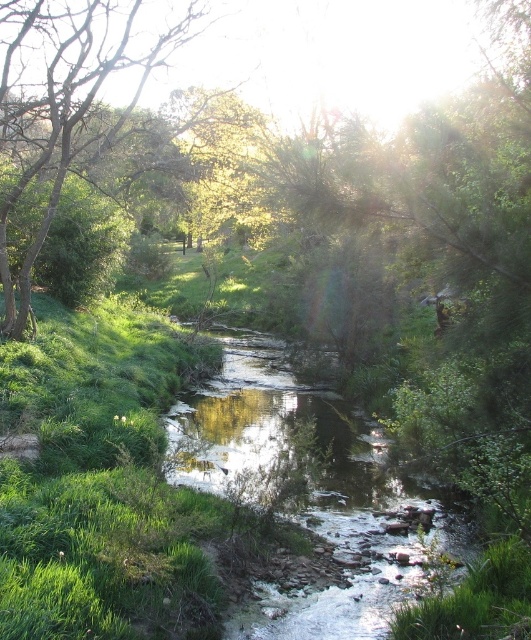
Question: Is clear water stream at center closer to camera compared to green leafy tree at left?

Choices:
 (A) no
 (B) yes

Answer: (B)

Question: Is clear water stream at center positioned before green leafy tree at left?

Choices:
 (A) no
 (B) yes

Answer: (B)

Question: Which of the following is the closest to the observer?

Choices:
 (A) clear water stream at center
 (B) green leafy tree at left

Answer: (A)

Question: Which point is farther from the camera taking this photo?

Choices:
 (A) (123, 122)
 (B) (249, 376)

Answer: (B)

Question: Which object appears closest to the camera in this image?

Choices:
 (A) green leafy tree at left
 (B) clear water stream at center

Answer: (B)

Question: Can you confirm if clear water stream at center is thinner than green leafy tree at left?

Choices:
 (A) no
 (B) yes

Answer: (B)